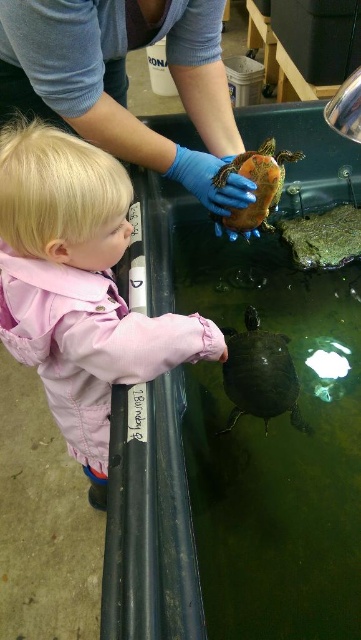
Question: Which of the following is the closest to the observer?

Choices:
 (A) (235, 342)
 (B) (264, 156)
 (C) (32, 10)
 (D) (80, 333)

Answer: (D)

Question: Is pink fabric toddler at lower left closer to camera compared to shiny orange tortoise at center?

Choices:
 (A) yes
 (B) no

Answer: (A)

Question: Can you confirm if shiny dark green tortoise at center is thinner than shiny orange tortoise at center?

Choices:
 (A) no
 (B) yes

Answer: (B)

Question: Considering the relative positions of pink fabric toddler at lower left and blue rubber glove at upper center in the image provided, where is pink fabric toddler at lower left located with respect to blue rubber glove at upper center?

Choices:
 (A) right
 (B) left

Answer: (B)

Question: Estimate the real-world distances between objects in this image. Which object is farther from the shiny orange tortoise at center?

Choices:
 (A) pink fabric toddler at lower left
 (B) blue rubber glove at upper center

Answer: (A)

Question: Which of the following is the farthest from the observer?

Choices:
 (A) shiny dark green tortoise at center
 (B) blue rubber glove at upper center
 (C) pink fabric toddler at lower left

Answer: (A)